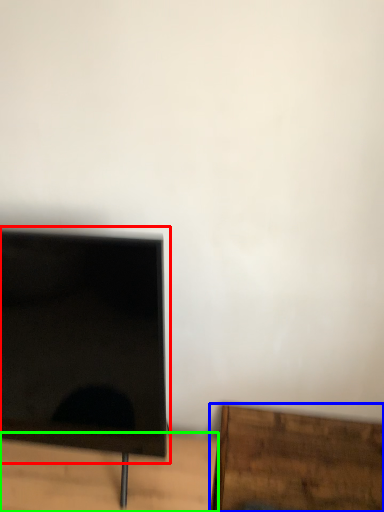
Question: Considering the real-world distances, which object is farthest from computer monitor (highlighted by a red box)? furniture (highlighted by a blue box) or table (highlighted by a green box)?

Choices:
 (A) furniture
 (B) table

Answer: (A)